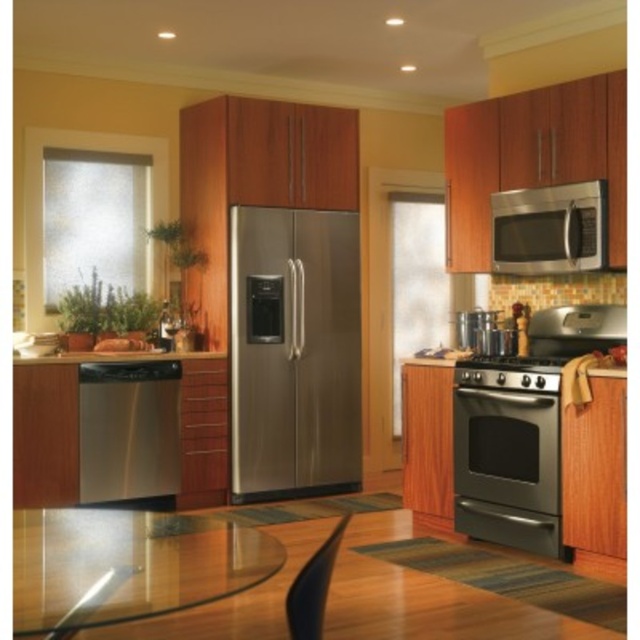
Is transparent glass table at lower center taller than satin black oven at lower right?

No.

At what (x,y) coordinates should I click in order to perform the action: click on transparent glass table at lower center. Please return your answer as a coordinate pair (x, y). The height and width of the screenshot is (640, 640). Looking at the image, I should click on (128, 564).

Identify the location of transparent glass table at lower center. Image resolution: width=640 pixels, height=640 pixels. (128, 564).

Find the location of a particular element. Image resolution: width=640 pixels, height=640 pixels. satin black oven at lower right is located at coordinates (508, 465).

Can you confirm if satin black oven at lower right is taller than satin stainless steel dishwasher at lower left?

Indeed, satin black oven at lower right has a greater height compared to satin stainless steel dishwasher at lower left.

Does point (502, 410) lie in front of point (140, 356)?

Yes, point (502, 410) is closer to viewer.

The height and width of the screenshot is (640, 640). Identify the location of satin black oven at lower right. (508, 465).

Does stainless steel refrigerator at center have a lesser width compared to satin black oven at lower right?

No, stainless steel refrigerator at center is not thinner than satin black oven at lower right.

The height and width of the screenshot is (640, 640). I want to click on stainless steel refrigerator at center, so click(292, 349).

Identify the location of stainless steel refrigerator at center. (292, 349).